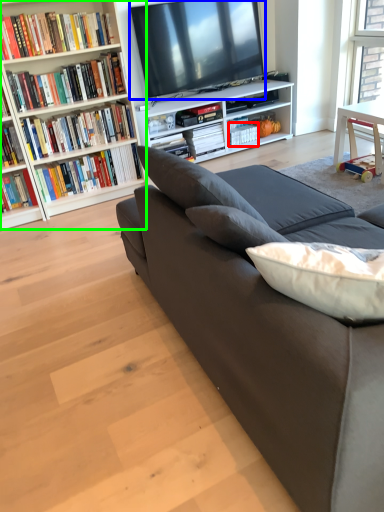
Question: Based on their relative distances, which object is farther from book (highlighted by a red box)? Choose from television (highlighted by a blue box) and bookcase (highlighted by a green box).

Choices:
 (A) television
 (B) bookcase

Answer: (B)